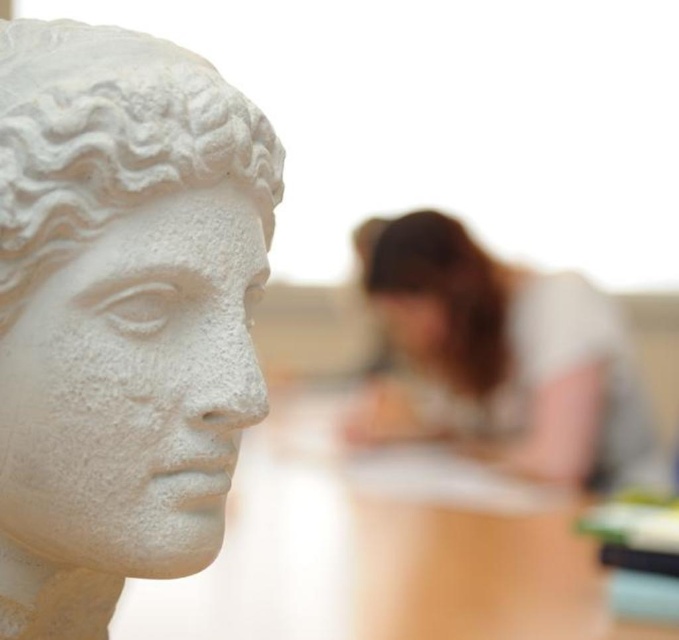
Is blurred hair at center wider than smooth brown hair at center?

Yes.

Does blurred hair at center have a lesser width compared to smooth brown hair at center?

In fact, blurred hair at center might be wider than smooth brown hair at center.

You are a GUI agent. You are given a task and a screenshot of the screen. Output one action in this format:
    pyautogui.click(x=<x>, y=<y>)
    Task: Click on the blurred hair at center
    The image size is (679, 640).
    Given the screenshot: What is the action you would take?
    pyautogui.click(x=496, y=356)

Where is `blurred hair at center`? This screenshot has width=679, height=640. blurred hair at center is located at coordinates (496, 356).

Does white marble statue at left appear under smooth brown hair at center?

Yes, white marble statue at left is below smooth brown hair at center.

Which is in front, point (164, 316) or point (392, 237)?

Positioned in front is point (164, 316).

The height and width of the screenshot is (640, 679). I want to click on white marble statue at left, so click(x=120, y=314).

Is point (60, 202) behind point (422, 433)?

No, it is in front of (422, 433).

Does white marble statue at left have a smaller size compared to blurred hair at center?

Indeed, white marble statue at left has a smaller size compared to blurred hair at center.

Does point (39, 129) lie in front of point (648, 440)?

Yes.

In order to click on white marble statue at left in this screenshot , I will do click(x=120, y=314).